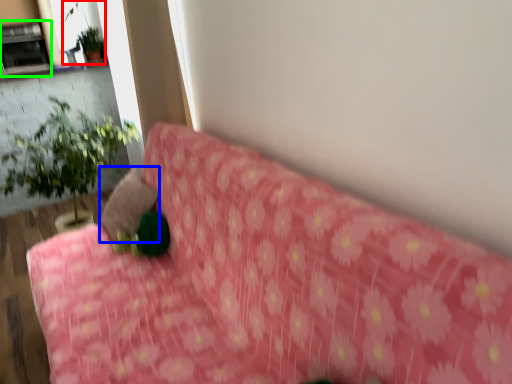
Question: Which is farther away from plant (highlighted by a red box)? pillow (highlighted by a blue box) or fireplace (highlighted by a green box)?

Choices:
 (A) pillow
 (B) fireplace

Answer: (A)